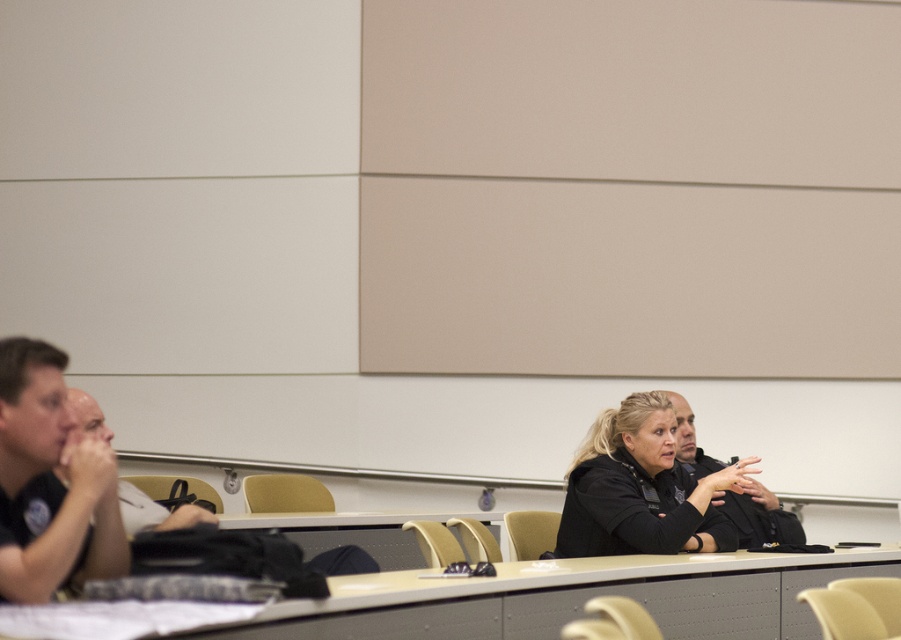
Question: Does black matte jacket at center come in front of bald head at left?

Choices:
 (A) no
 (B) yes

Answer: (A)

Question: Which object appears closest to the camera in this image?

Choices:
 (A) bald head at left
 (B) black matte shirt at left
 (C) black matte jacket at center
 (D) black uniform at center

Answer: (B)

Question: Can you confirm if smooth beige table at lower center is thinner than black uniform at center?

Choices:
 (A) no
 (B) yes

Answer: (A)

Question: Among these objects, which one is nearest to the camera?

Choices:
 (A) black matte jacket at center
 (B) bald head at left
 (C) black matte shirt at left
 (D) smooth beige table at lower center

Answer: (D)

Question: Can you confirm if black matte shirt at left is positioned above bald head at left?

Choices:
 (A) no
 (B) yes

Answer: (B)

Question: Which point is closer to the camera taking this photo?

Choices:
 (A) (0, 598)
 (B) (201, 513)
 (C) (738, 508)
 (D) (858, 557)

Answer: (A)